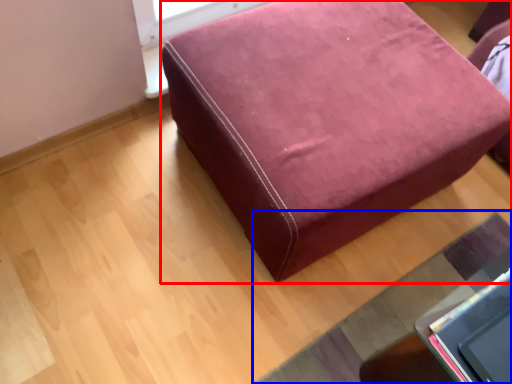
Question: Which object is further to the camera taking this photo, furniture (highlighted by a red box) or mat (highlighted by a blue box)?

Choices:
 (A) furniture
 (B) mat

Answer: (B)